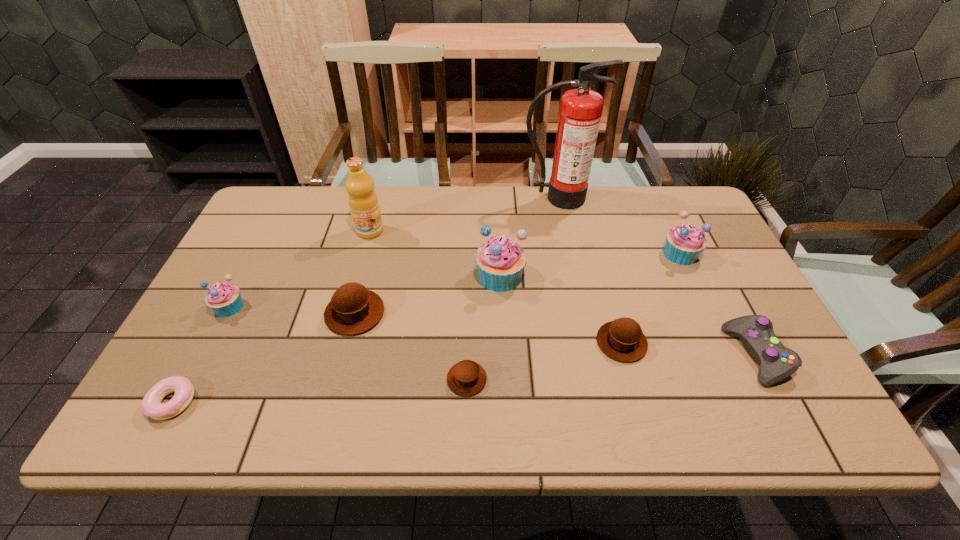
This screenshot has width=960, height=540. What are the coordinates of `fire extinguisher` in the screenshot? It's located at (580, 113).

Locate an element on the screen. the tallest object is located at coordinates (580, 113).

The height and width of the screenshot is (540, 960). Find the location of `the ninth shortest object`. the ninth shortest object is located at coordinates (363, 201).

Image resolution: width=960 pixels, height=540 pixels. I want to click on fruit juice, so click(x=363, y=201).

Where is `the biggest blue muffin`? the biggest blue muffin is located at coordinates (500, 261).

This screenshot has height=540, width=960. Identify the location of the tallest muffin. pyautogui.click(x=500, y=261).

The width and height of the screenshot is (960, 540). Find the location of `the seventh shortest object`. the seventh shortest object is located at coordinates (684, 243).

The image size is (960, 540). Identify the location of the rightmost blue muffin. (684, 243).

You are a GUI agent. You are given a task and a screenshot of the screen. Output one action in this format:
    pyautogui.click(x=<x>, y=<y>)
    Task: Click on the leftmost blue muffin
    
    Given the screenshot: What is the action you would take?
    pyautogui.click(x=225, y=300)

This screenshot has height=540, width=960. What are the coordinates of `the smallest blue muffin` in the screenshot? It's located at (225, 300).